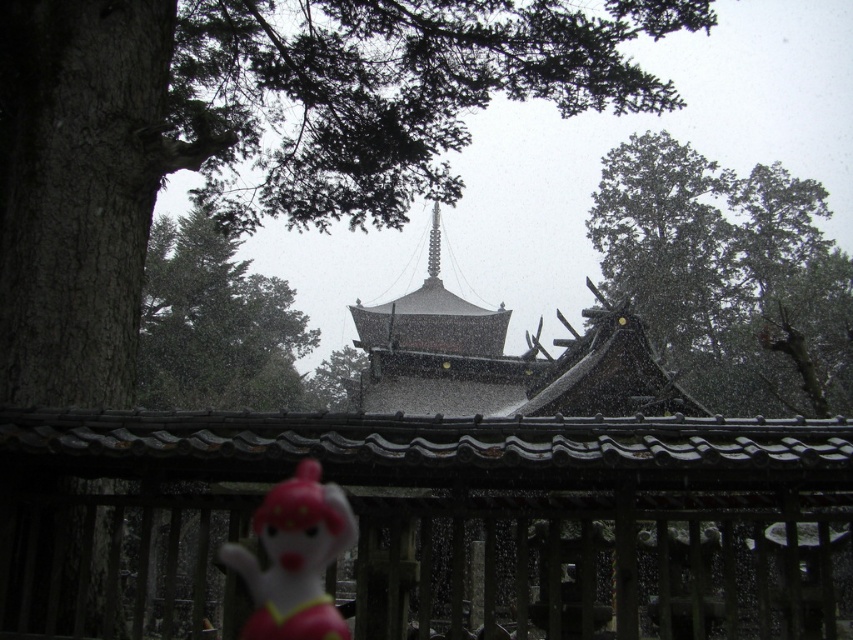
Can you confirm if green matte tree at upper right is positioned below pink rubber monkey at lower left?

Answer: No.

This screenshot has width=853, height=640. Describe the element at coordinates (727, 276) in the screenshot. I see `green matte tree at upper right` at that location.

Looking at this image, who is more forward, (688, 308) or (317, 598)?

Positioned in front is point (317, 598).

Locate an element on the screen. This screenshot has width=853, height=640. green matte tree at upper right is located at coordinates (727, 276).

Between green matte tree at upper right and green leafy tree at upper center, which one appears on the left side from the viewer's perspective?

From the viewer's perspective, green leafy tree at upper center appears more on the left side.

Find the location of a particular element. The image size is (853, 640). green matte tree at upper right is located at coordinates (727, 276).

Measure the distance from green leafy tree at upper center to pink rubber monkey at lower left.

A distance of 142.09 feet exists between green leafy tree at upper center and pink rubber monkey at lower left.

Who is lower down, green leafy tree at upper center or pink rubber monkey at lower left?

pink rubber monkey at lower left is lower down.

Is point (149, 250) farther from camera compared to point (318, 465)?

Yes, it is.

At what (x,y) coordinates should I click in order to perform the action: click on green leafy tree at upper center. Please return your answer as a coordinate pair (x, y). The image size is (853, 640). Looking at the image, I should click on (215, 324).